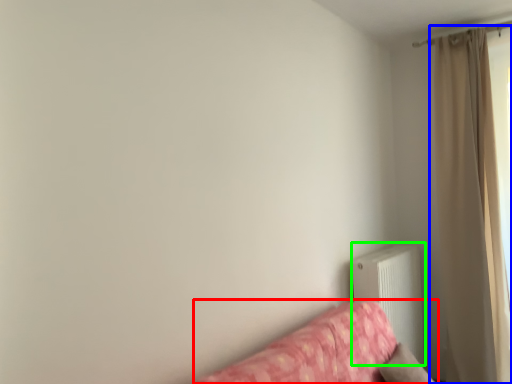
Question: Which object is the farthest from studio couch (highlighted by a red box)? Choose among these: curtain (highlighted by a blue box) or radiator (highlighted by a green box).

Choices:
 (A) curtain
 (B) radiator

Answer: (A)